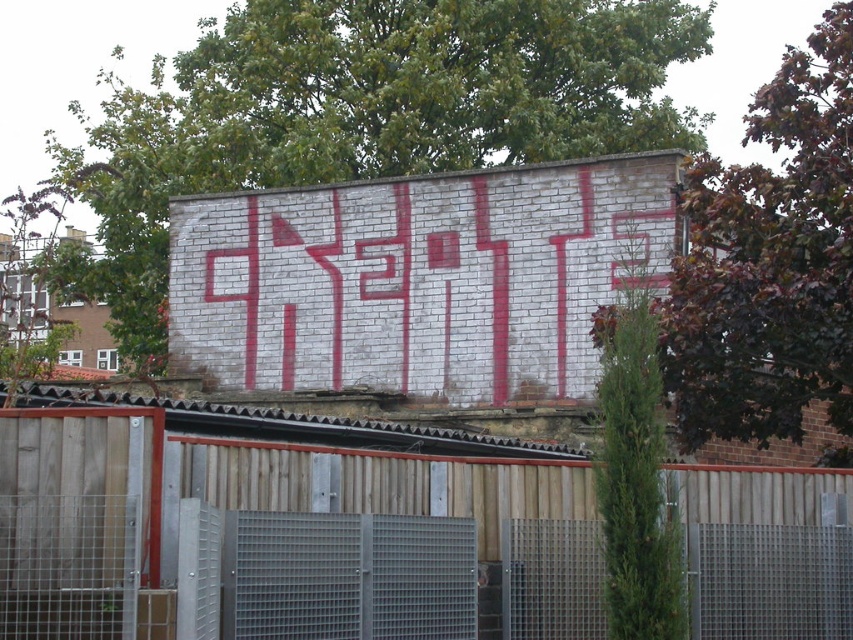
Question: Which point is farther to the camera?

Choices:
 (A) (12, 538)
 (B) (660, 202)

Answer: (B)

Question: Does white brick wall at center have a greater width compared to wooden fence at center?

Choices:
 (A) yes
 (B) no

Answer: (A)

Question: Is white brick wall at center thinner than wooden fence at center?

Choices:
 (A) yes
 (B) no

Answer: (B)

Question: Which point is farther from the camera taking this photo?

Choices:
 (A) (585, 582)
 (B) (241, 289)

Answer: (B)

Question: Does white brick wall at center come in front of wooden fence at center?

Choices:
 (A) yes
 (B) no

Answer: (B)